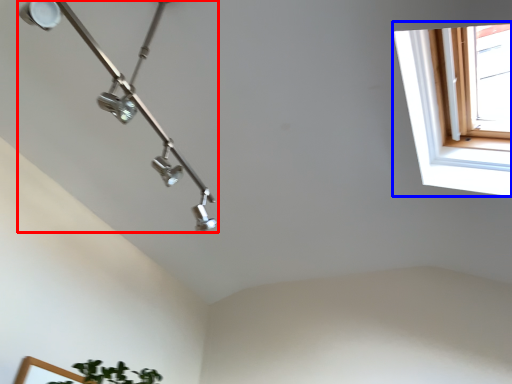
Question: Among these objects, which one is nearest to the camera, lamp (highlighted by a red box) or window (highlighted by a blue box)?

Choices:
 (A) lamp
 (B) window

Answer: (A)